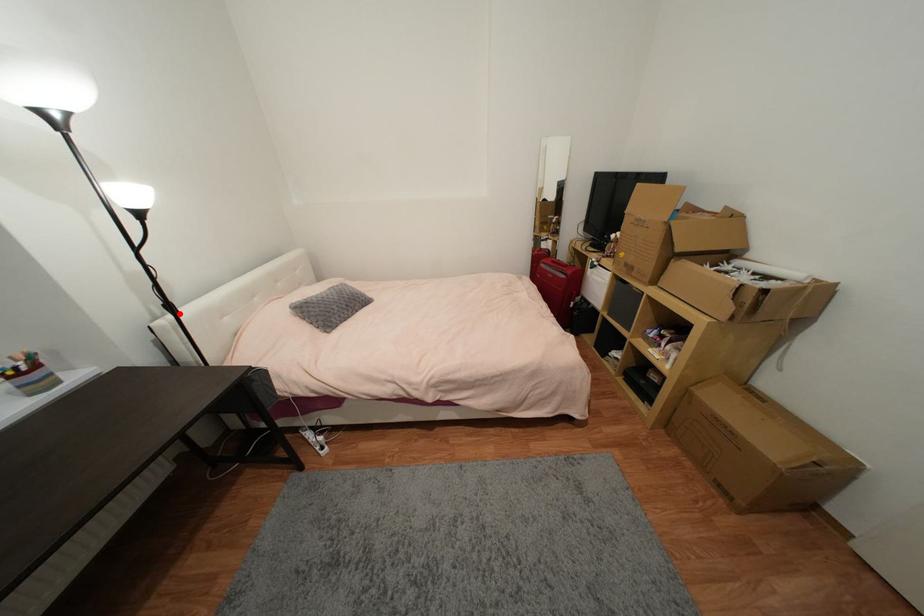
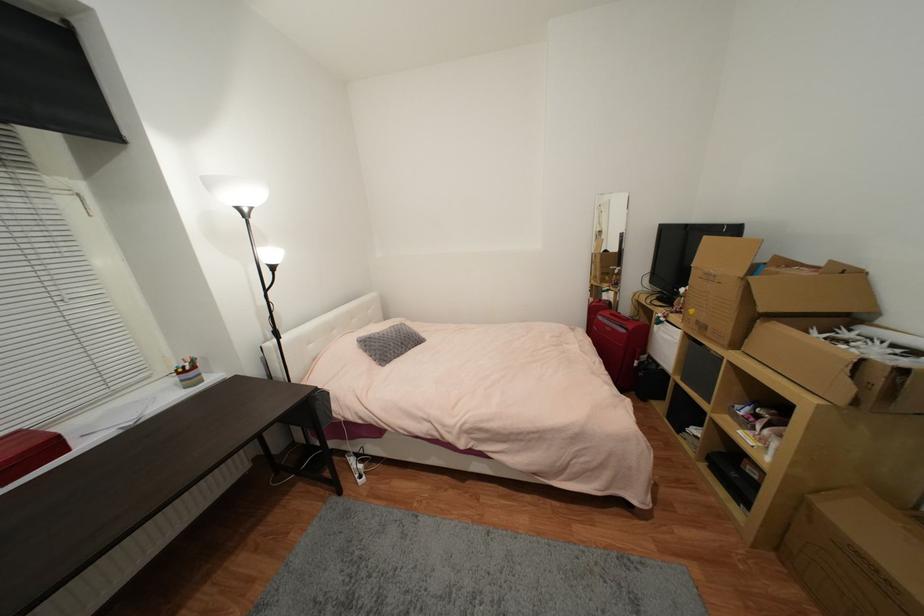
Question: I am providing you with two images of the same scene from different viewpoints. Image1 has a red point marked. In image2, the corresponding 3D location appears at what relative position? Reply with the corresponding letter.

Choices:
 (A) Closer
 (B) Farther

Answer: (A)